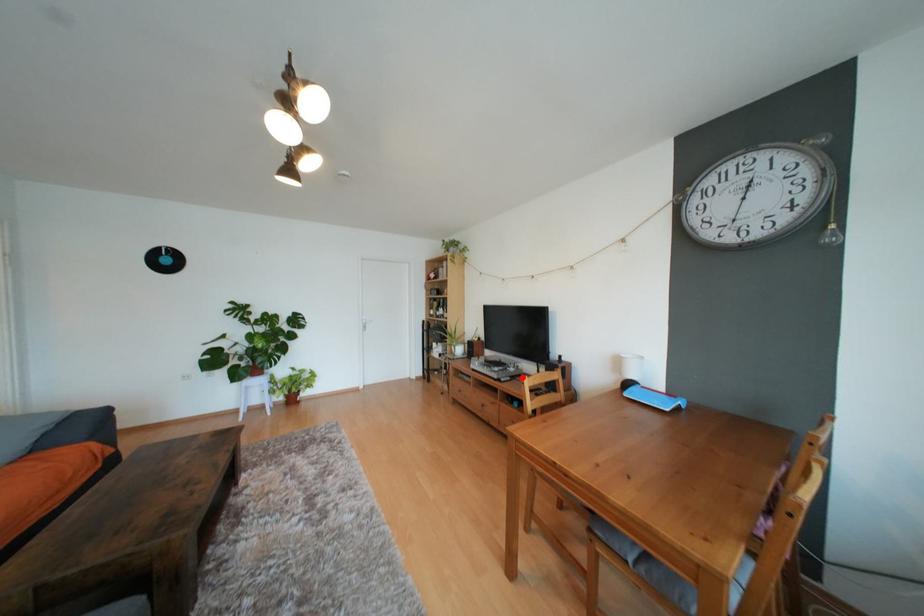
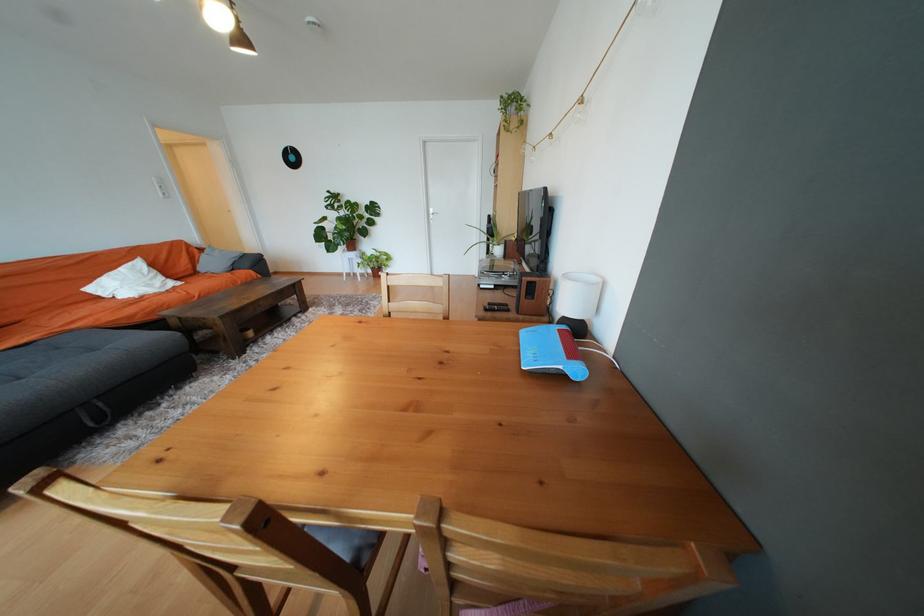
Question: A red point is marked in image1. In image2, is the corresponding 3D point closer to the camera or farther? Reply with the corresponding letter.

Choices:
 (A) The corresponding 3D point is closer.
 (B) The corresponding 3D point is farther.

Answer: (A)